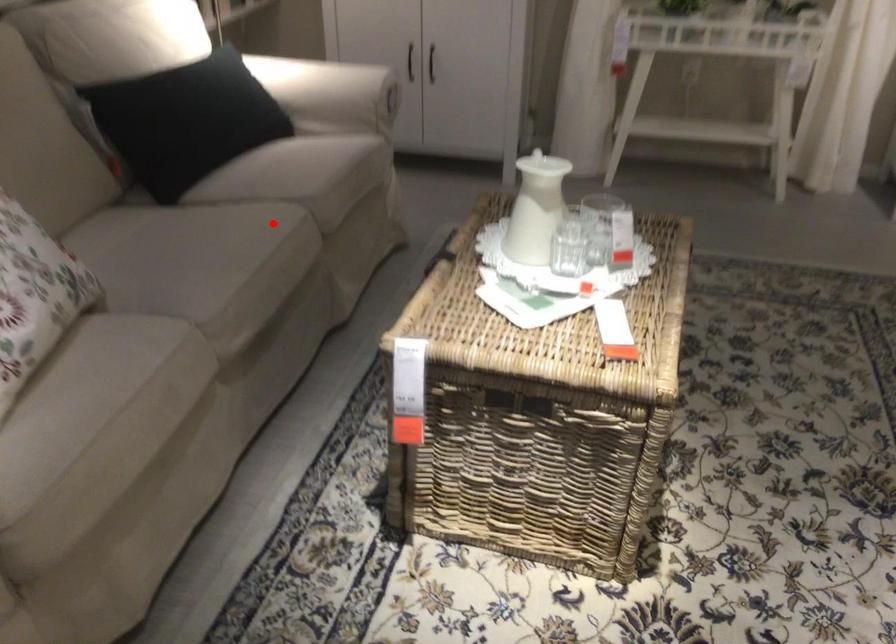
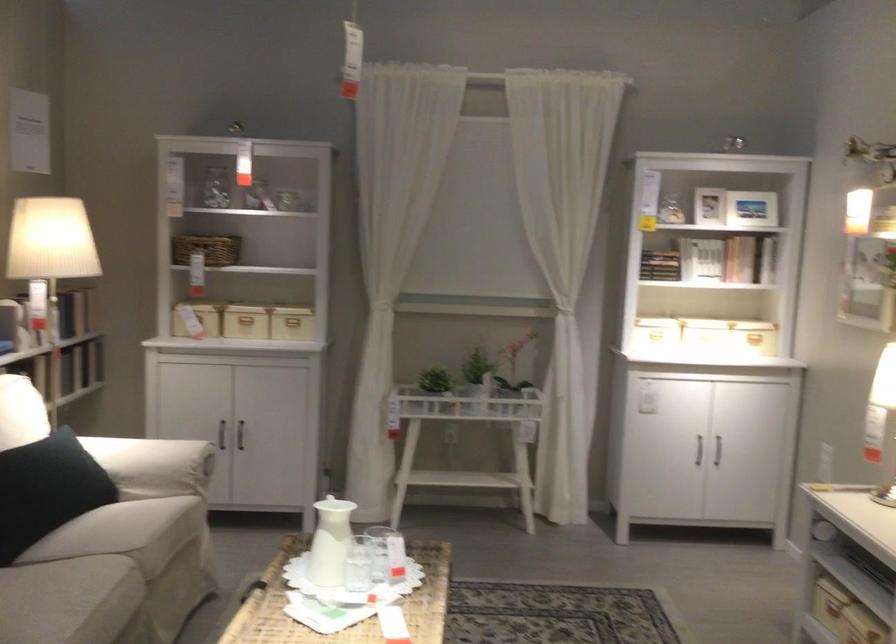
In the second image, find the point that corresponds to the highlighted location in the first image.

(110, 576)